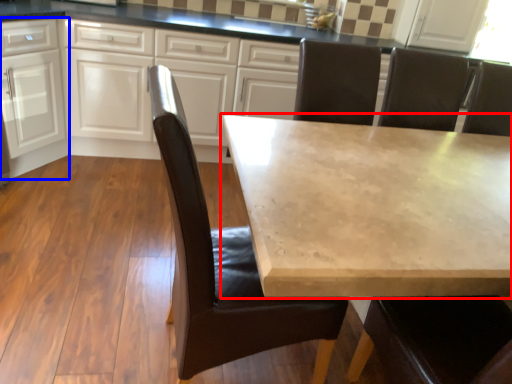
Question: Among these objects, which one is farthest to the camera, table (highlighted by a red box) or cabinetry (highlighted by a blue box)?

Choices:
 (A) table
 (B) cabinetry

Answer: (B)